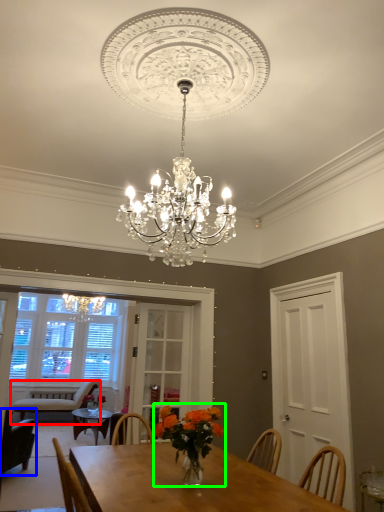
Question: Based on their relative distances, which object is farther from chair (highlighted by a red box)? Choose from chair (highlighted by a blue box) and floral arrangement (highlighted by a green box).

Choices:
 (A) chair
 (B) floral arrangement

Answer: (B)